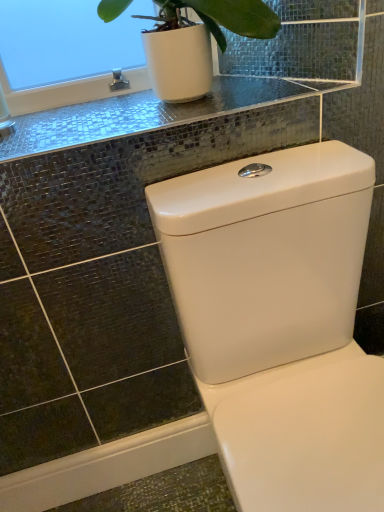
Question: Considering the positions of point (132, 129) and point (172, 244), is point (132, 129) closer or farther from the camera than point (172, 244)?

Choices:
 (A) farther
 (B) closer

Answer: (A)

Question: Do you think shiny glass counter top at upper center is within white glossy toilet at center, or outside of it?

Choices:
 (A) outside
 (B) inside

Answer: (A)

Question: Is shiny glass counter top at upper center bigger or smaller than white glossy toilet at center?

Choices:
 (A) small
 (B) big

Answer: (A)

Question: Is white glossy toilet at center bigger or smaller than shiny glass counter top at upper center?

Choices:
 (A) small
 (B) big

Answer: (B)

Question: Is white glossy toilet at center situated inside shiny glass counter top at upper center or outside?

Choices:
 (A) inside
 (B) outside

Answer: (B)

Question: From the image's perspective, relative to shiny glass counter top at upper center, is white glossy toilet at center above or below?

Choices:
 (A) below
 (B) above

Answer: (A)

Question: Visually, is white glossy toilet at center positioned to the left or to the right of shiny glass counter top at upper center?

Choices:
 (A) right
 (B) left

Answer: (A)